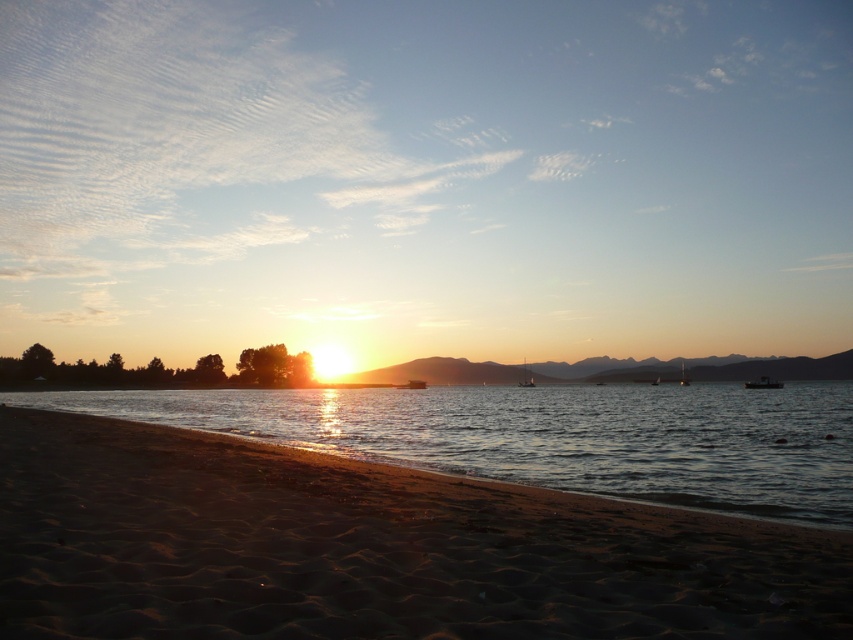
Question: Can you confirm if sandy beach at lower left is positioned to the right of glistening water at center?

Choices:
 (A) yes
 (B) no

Answer: (B)

Question: Is the position of sandy beach at lower left less distant than that of glistening water at center?

Choices:
 (A) no
 (B) yes

Answer: (B)

Question: Is sandy beach at lower left thinner than glistening water at center?

Choices:
 (A) yes
 (B) no

Answer: (A)

Question: Which of the following is the farthest from the observer?

Choices:
 (A) (807, 556)
 (B) (195, 426)

Answer: (B)